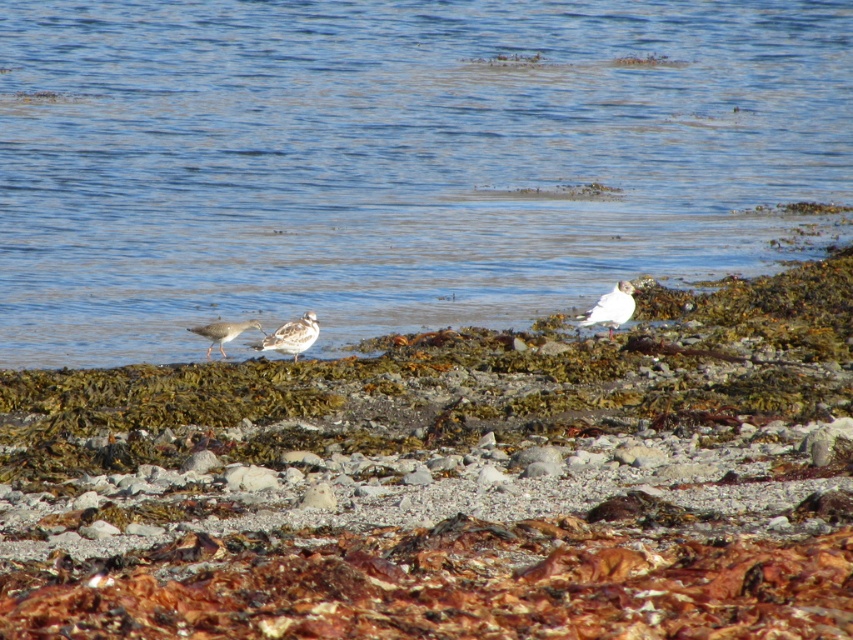
Does white matte bird at right have a larger size compared to white feathered bird at center?

Yes.

Is white matte bird at right taller than white feathered bird at center?

Yes.

Which is in front, point (627, 282) or point (287, 353)?

Point (287, 353) is more forward.

Identify the location of white matte bird at right. This screenshot has width=853, height=640. (610, 307).

How much distance is there between blue water at center and white matte bird at right?

blue water at center and white matte bird at right are 6.53 meters apart from each other.

Who is higher up, blue water at center or white matte bird at right?

blue water at center is above.

Does point (827, 152) come in front of point (625, 312)?

No, (827, 152) is further to viewer.

Find the location of a particular element. The image size is (853, 640). blue water at center is located at coordinates (392, 160).

Between white matte bird at right and speckled gray bird at center, which one appears on the left side from the viewer's perspective?

speckled gray bird at center is more to the left.

Does white matte bird at right have a greater height compared to speckled gray bird at center?

Yes.

The height and width of the screenshot is (640, 853). What are the coordinates of `white matte bird at right` in the screenshot? It's located at (610, 307).

At what (x,y) coordinates should I click in order to perform the action: click on white matte bird at right. Please return your answer as a coordinate pair (x, y). Looking at the image, I should click on (610, 307).